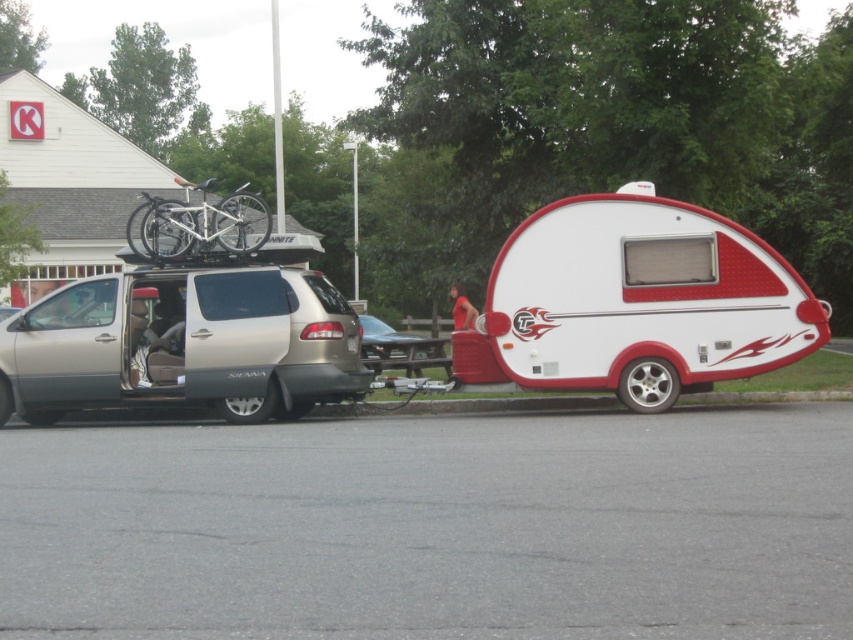
Question: Which is farther from the white matte bicycle at upper left?

Choices:
 (A) satin silver van at left
 (B) white matte camper at center

Answer: (B)

Question: Does satin silver van at left have a smaller size compared to white matte bicycle at upper left?

Choices:
 (A) no
 (B) yes

Answer: (B)

Question: In this image, where is white matte camper at center located relative to satin silver van at left?

Choices:
 (A) above
 (B) below

Answer: (A)

Question: Is the position of white matte camper at center more distant than that of white matte bicycle at upper left?

Choices:
 (A) no
 (B) yes

Answer: (A)

Question: Which of the following is the farthest from the observer?

Choices:
 (A) (154, 378)
 (B) (199, 228)
 (C) (653, 195)

Answer: (B)

Question: Among these points, which one is nearest to the camera?

Choices:
 (A) (135, 300)
 (B) (770, 358)

Answer: (B)